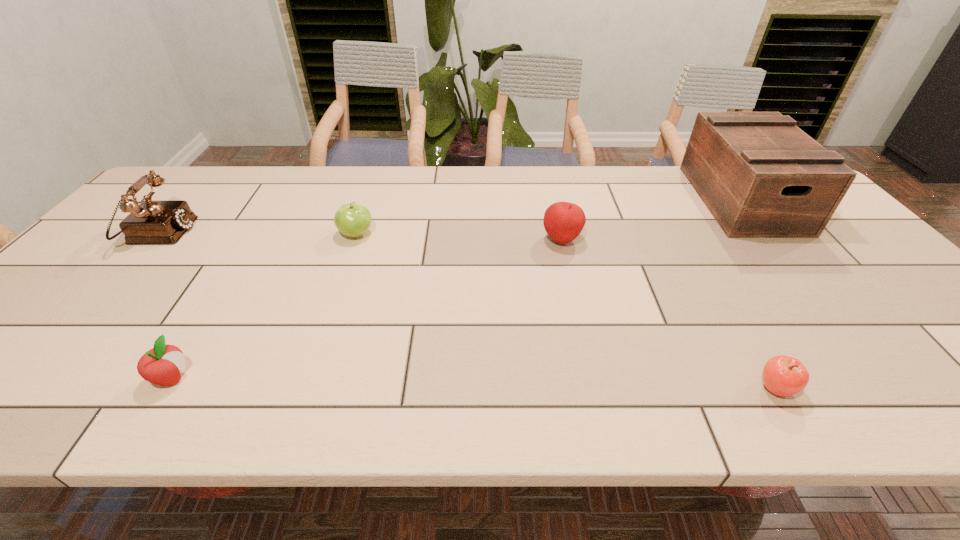
Where is `free space at the left edge of the desktop`? free space at the left edge of the desktop is located at coordinates (75, 275).

At what (x,y) coordinates should I click in order to perform the action: click on vacant area at the right edge. Please return your answer as a coordinate pair (x, y). Looking at the image, I should click on (833, 261).

Locate an element on the screen. free point between the leftmost apple and the rightmost apple is located at coordinates (473, 383).

You are a GUI agent. You are given a task and a screenshot of the screen. Output one action in this format:
    pyautogui.click(x=<x>, y=<y>)
    Task: Click on the vacant area that lies between the fourth object from right to left and the third apple from left to right
    This screenshot has height=540, width=960.
    Given the screenshot: What is the action you would take?
    pyautogui.click(x=459, y=237)

At what (x,y) coordinates should I click in order to perform the action: click on vacant area that lies between the tallest object and the fifth shortest object. Please return your answer as a coordinate pair (x, y). The width and height of the screenshot is (960, 540). Looking at the image, I should click on (450, 217).

Find the location of a particular element. The image size is (960, 540). vacant space in between the tallest object and the second apple from right to left is located at coordinates (652, 220).

Identify the location of free spot between the leftmost apple and the third object from left to right. (264, 306).

Identify the location of vacant area that lies between the second apple from left to right and the second apple from right to left. (459, 237).

I want to click on free space between the second object from left to right and the box, so click(457, 288).

This screenshot has height=540, width=960. In order to click on vacant space in between the fifth object from right to left and the leftmost object in this screenshot , I will do `click(165, 306)`.